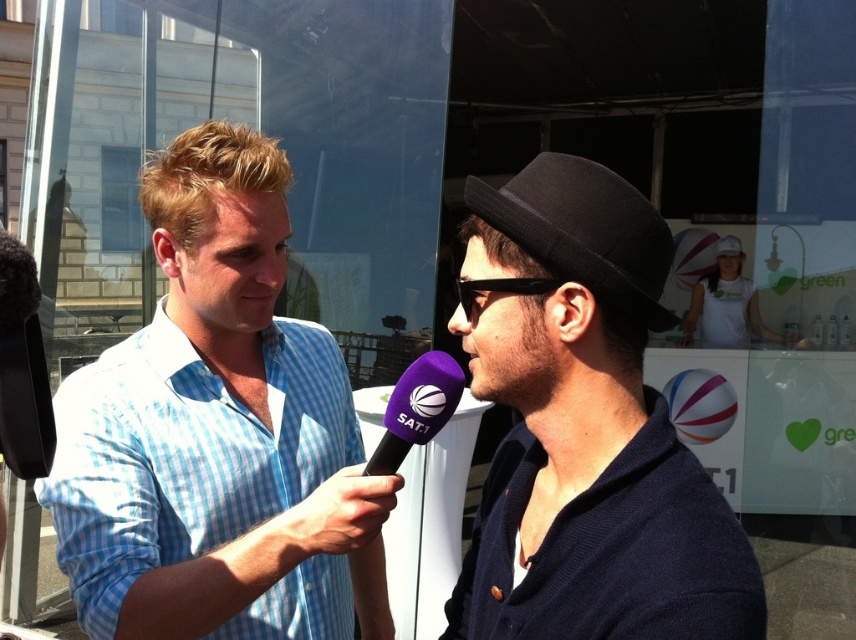
Is purple matte microphone at center shorter than black plastic sunglasses at center?

In fact, purple matte microphone at center may be taller than black plastic sunglasses at center.

Between purple matte microphone at center and black plastic sunglasses at center, which one appears on the left side from the viewer's perspective?

purple matte microphone at center is more to the left.

Does point (407, 442) lie in front of point (544, 289)?

No, it is behind (544, 289).

Locate an element on the screen. The width and height of the screenshot is (856, 640). purple matte microphone at center is located at coordinates (415, 408).

The image size is (856, 640). What are the coordinates of `black felt fedora at center` in the screenshot? It's located at (584, 230).

Locate an element on the screen. This screenshot has height=640, width=856. black felt fedora at center is located at coordinates (584, 230).

From the picture: Is dark blue sweater at center bigger than black plastic sunglasses at center?

Correct, dark blue sweater at center is larger in size than black plastic sunglasses at center.

Identify the location of dark blue sweater at center. The height and width of the screenshot is (640, 856). (586, 429).

Is point (528, 636) behind point (473, 289)?

No, it is not.

This screenshot has height=640, width=856. I want to click on dark blue sweater at center, so click(586, 429).